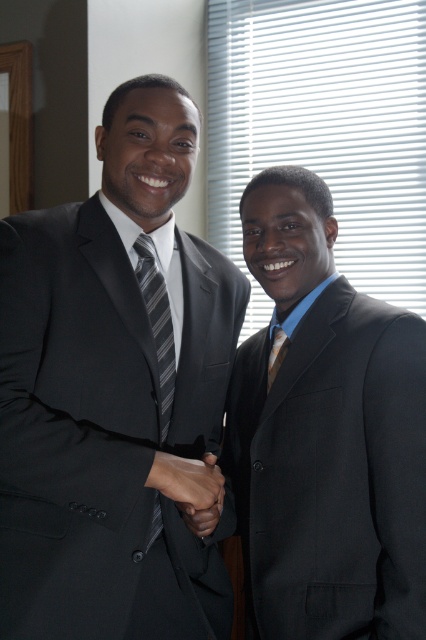
Does matte black suit at right have a lesser height compared to striped fabric tie at center?

No, matte black suit at right is not shorter than striped fabric tie at center.

Who is taller, matte black suit at right or striped fabric tie at center?

matte black suit at right

Measure the distance between matte black suit at right and camera.

They are 3.40 feet apart.

Where is `matte black suit at right`? The width and height of the screenshot is (426, 640). matte black suit at right is located at coordinates (325, 435).

Is point (166, 397) farther from camera compared to point (273, 376)?

No, it is in front of (273, 376).

Does striped fabric tie at center appear on the right side of gold textured tie at right?

Incorrect, striped fabric tie at center is not on the right side of gold textured tie at right.

Who is more forward, (152, 310) or (273, 362)?

Point (152, 310)

This screenshot has width=426, height=640. I want to click on striped fabric tie at center, so pos(158,323).

Can you confirm if matte black suit at left is positioned to the left of striped fabric tie at center?

Indeed, matte black suit at left is positioned on the left side of striped fabric tie at center.

Can you confirm if matte black suit at left is positioned to the right of striped fabric tie at center?

Incorrect, matte black suit at left is not on the right side of striped fabric tie at center.

Does point (141, 285) come closer to viewer compared to point (155, 502)?

No, it is behind (155, 502).

Locate an element on the screen. matte black suit at left is located at coordinates (117, 394).